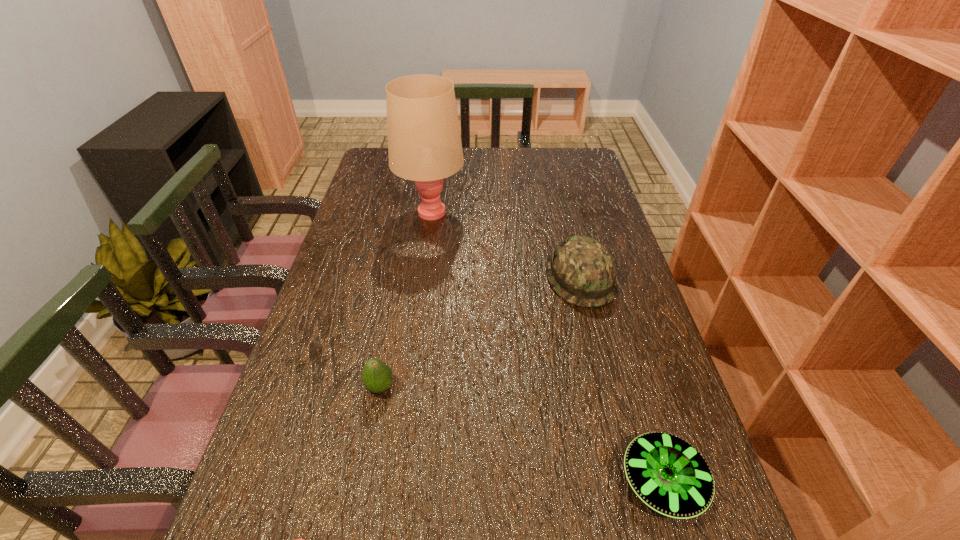
Locate an element on the screen. Image resolution: width=960 pixels, height=540 pixels. free space that is in between the lampshade and the third shortest object is located at coordinates (405, 300).

Identify the location of free spot between the fourth tallest object and the fourth nearest object. This screenshot has height=540, width=960. [x=621, y=380].

At what (x,y) coordinates should I click in order to perform the action: click on free space between the third nearest object and the headwear. Please return your answer as a coordinate pair (x, y). Looking at the image, I should click on (480, 333).

At what (x,y) coordinates should I click in order to perform the action: click on vacant space that is in between the tallest object and the second farthest object. Please return your answer as a coordinate pair (x, y). The image size is (960, 540). Looking at the image, I should click on (506, 246).

Choose which object is the third nearest neighbor to the fourth shortest object. Please provide its 2D coordinates. Your answer should be formatted as a tuple, i.e. [(x, y)], where the tuple contains the x and y coordinates of a point satisfying the conditions above.

[(377, 376)]

Select which object appears as the fourth closest to the third tallest object. Please provide its 2D coordinates. Your answer should be formatted as a tuple, i.e. [(x, y)], where the tuple contains the x and y coordinates of a point satisfying the conditions above.

[(424, 144)]

This screenshot has width=960, height=540. In order to click on vacant region that satisfies the following two spatial constraints: 1. on the front side of the farthest object; 2. on the right side of the fourth shortest object in this screenshot , I will do tap(421, 279).